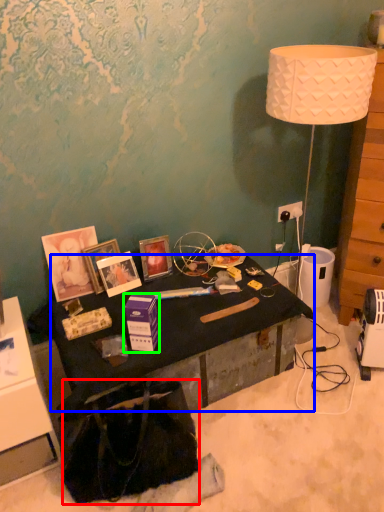
Question: Which is farther away from handbag (highlighted by a red box)? desk (highlighted by a blue box) or box (highlighted by a green box)?

Choices:
 (A) desk
 (B) box

Answer: (B)